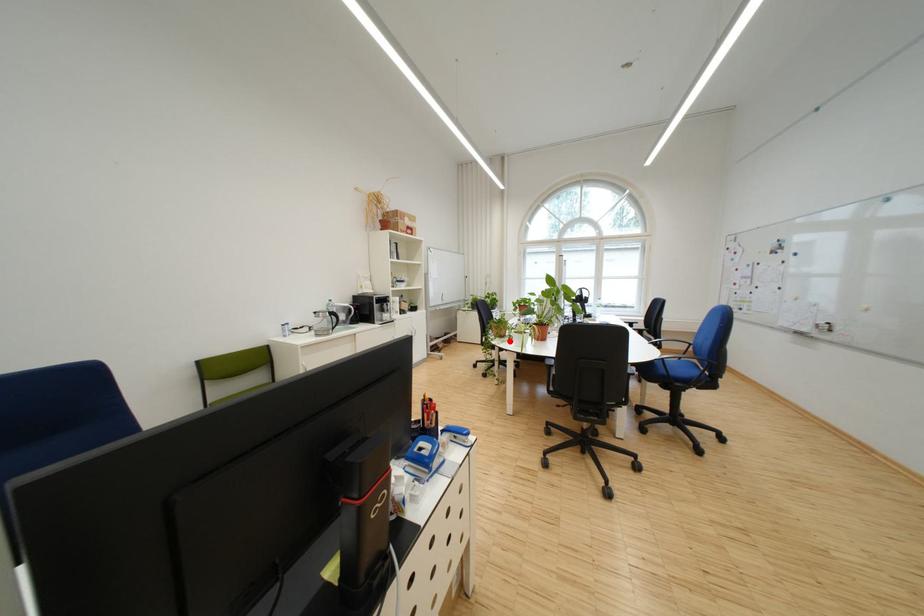
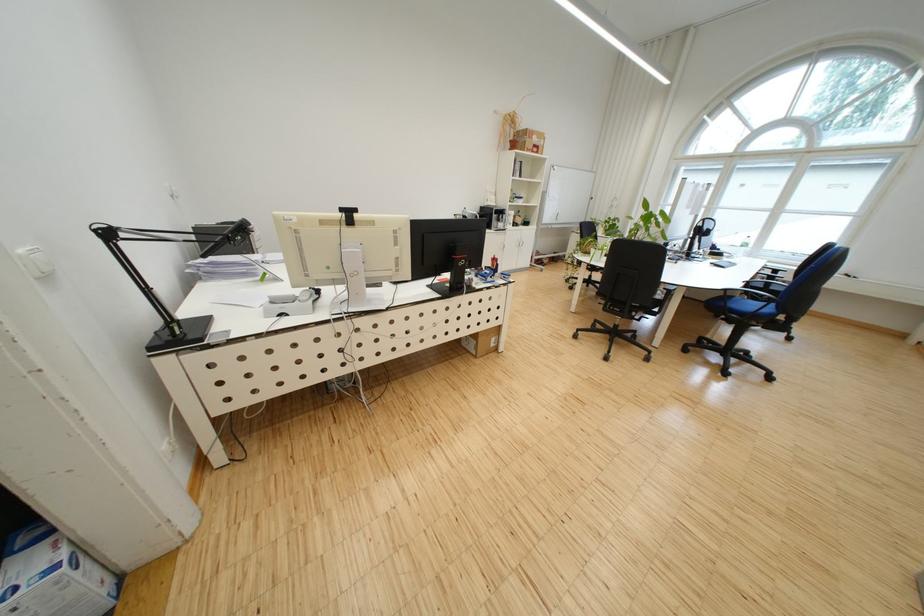
Question: I am providing you with two images of the same scene from different viewpoints. In image1, a red point is highlighted. Considering the same 3D point in image2, which of the following is correct?

Choices:
 (A) It is closer
 (B) It is farther

Answer: (A)